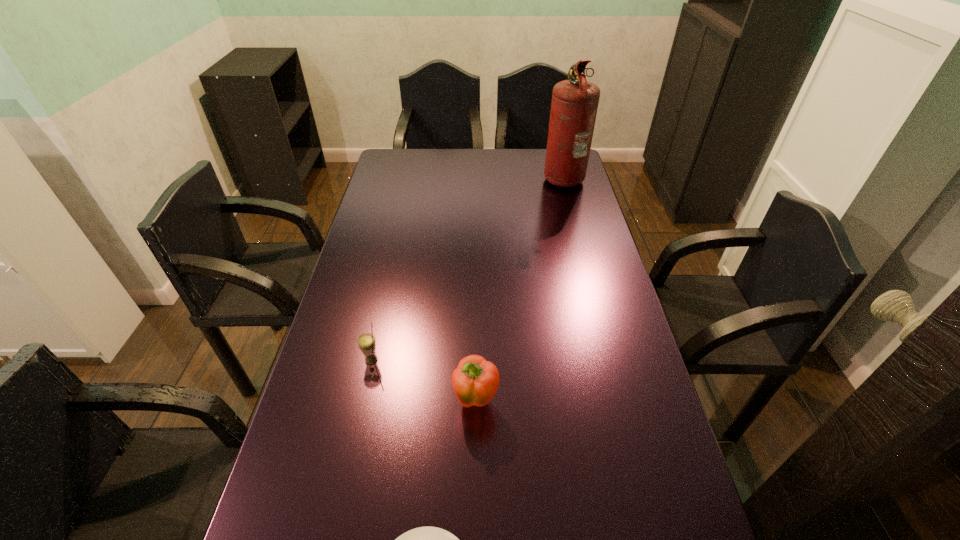
The width and height of the screenshot is (960, 540). Identify the location of free area in between the leftmost object and the pepper. (423, 381).

Image resolution: width=960 pixels, height=540 pixels. I want to click on vacant area that lies between the leftmost object and the third farthest object, so click(x=423, y=381).

Find the location of `blank region between the straw for drinking and the fire extinguisher`. blank region between the straw for drinking and the fire extinguisher is located at coordinates (468, 268).

At what (x,y) coordinates should I click in order to perform the action: click on object identified as the third closest to the fire extinguisher. Please return your answer as a coordinate pair (x, y). This screenshot has width=960, height=540. Looking at the image, I should click on point(423,539).

Select which object appears as the second closest to the shortest object. Please provide its 2D coordinates. Your answer should be formatted as a tuple, i.e. [(x, y)], where the tuple contains the x and y coordinates of a point satisfying the conditions above.

[(366, 342)]

Find the location of a particular element. The image size is (960, 540). free spot that satisfies the following two spatial constraints: 1. on the front side of the third farthest object; 2. on the left side of the third nearest object is located at coordinates (363, 401).

You are a GUI agent. You are given a task and a screenshot of the screen. Output one action in this format:
    pyautogui.click(x=<x>, y=<y>)
    Task: Click on the vacant space that satisfies the following two spatial constraints: 1. at the front of the farthest object where the nozzle is aimed; 2. on the front side of the second farthest object
    The image size is (960, 540).
    Given the screenshot: What is the action you would take?
    pyautogui.click(x=612, y=360)